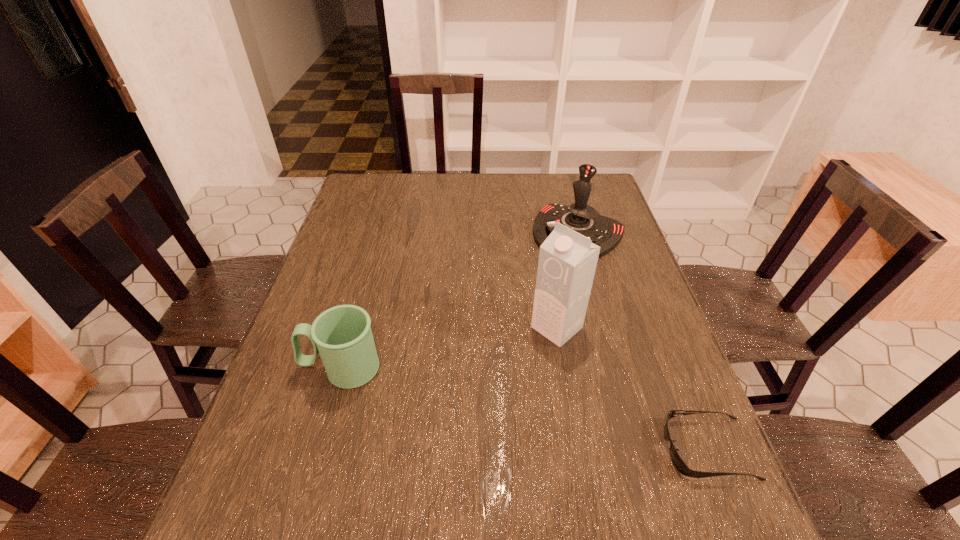
Where is `vacant region located on the front-facing side of the nearest object`? vacant region located on the front-facing side of the nearest object is located at coordinates (555, 449).

Locate an element on the screen. The image size is (960, 540). vacant space located on the handle side of the second tallest object is located at coordinates (516, 327).

This screenshot has height=540, width=960. Find the location of `vacant point located 0.300m on the handle side of the second tallest object`. vacant point located 0.300m on the handle side of the second tallest object is located at coordinates (518, 325).

You are a GUI agent. You are given a task and a screenshot of the screen. Output one action in this format:
    pyautogui.click(x=<x>, y=<y>)
    Task: Click on the free spot located 0.400m on the handle side of the second tallest object
    This screenshot has width=960, height=540.
    Given the screenshot: What is the action you would take?
    pyautogui.click(x=500, y=353)

The width and height of the screenshot is (960, 540). Identify the location of free location located on the front label of the second farthest object. (447, 420).

You are a GUI agent. You are given a task and a screenshot of the screen. Output one action in this format:
    pyautogui.click(x=<x>, y=<y>)
    Task: Click on the free space located on the front label of the second farthest object
    This screenshot has height=540, width=960.
    Given the screenshot: What is the action you would take?
    pyautogui.click(x=451, y=416)

At what (x,y) coordinates should I click in order to perform the action: click on vacant area situated 0.340m on the front label of the second farthest object. Please return your answer as a coordinate pair (x, y). Looking at the image, I should click on (433, 432).

Find the location of a particular element. object at the far edge is located at coordinates (605, 232).

Image resolution: width=960 pixels, height=540 pixels. What are the coordinates of `object situated at the near edge` in the screenshot? It's located at (681, 466).

I want to click on object located in the left edge section of the desktop, so click(342, 335).